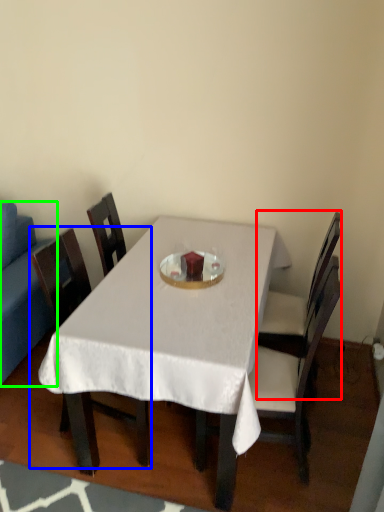
Question: Which object is positioned farthest from chair (highlighted by a red box)? Select from chair (highlighted by a blue box) and studio couch (highlighted by a green box).

Choices:
 (A) chair
 (B) studio couch

Answer: (B)